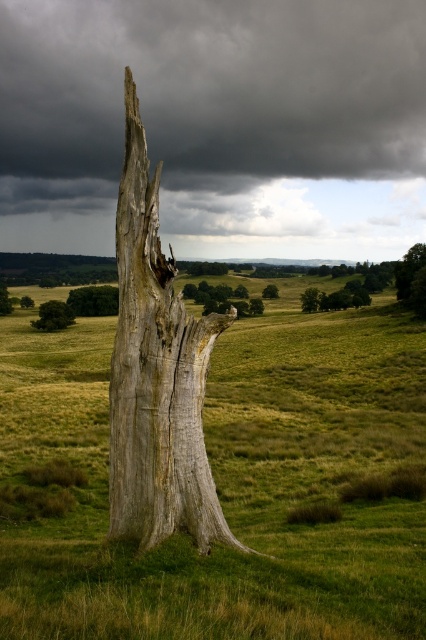
Based on the photo, which is more to the right, green leafy tree at upper right or smooth gray tree trunk at center?

From the viewer's perspective, green leafy tree at upper right appears more on the right side.

Who is more distant from viewer, [405,273] or [224,310]?

The point [224,310] is behind.

Is point (408, 252) farther from camera compared to point (186, 296)?

No.

Identify the location of green leafy tree at upper right. (412, 278).

Is gray weathered wood at center closer to the viewer compared to green rough bark tree at center?

Yes, gray weathered wood at center is closer to the viewer.

Does gray weathered wood at center appear over green rough bark tree at center?

Actually, gray weathered wood at center is below green rough bark tree at center.

Describe the element at coordinates (157, 374) in the screenshot. The height and width of the screenshot is (640, 426). I see `gray weathered wood at center` at that location.

This screenshot has height=640, width=426. I want to click on gray weathered wood at center, so click(157, 374).

Based on the photo, can you confirm if green matte tree at lower left is shorter than green grassy tree at center?

No, green matte tree at lower left is not shorter than green grassy tree at center.

Consider the image. Who is positioned more to the left, green matte tree at lower left or green grassy tree at center?

green matte tree at lower left is more to the left.

Identify the location of green matte tree at lower left. This screenshot has width=426, height=640. (54, 316).